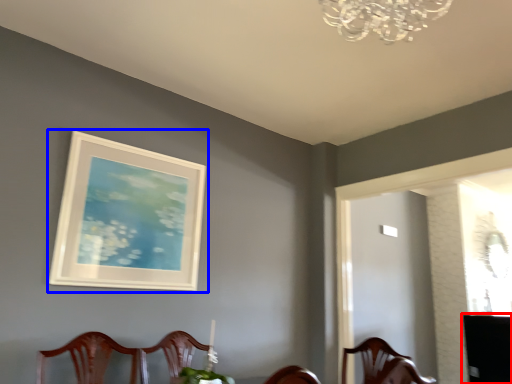
Question: Which of the following is the farthest to the observer, table (highlighted by a red box) or picture frame (highlighted by a blue box)?

Choices:
 (A) table
 (B) picture frame

Answer: (A)